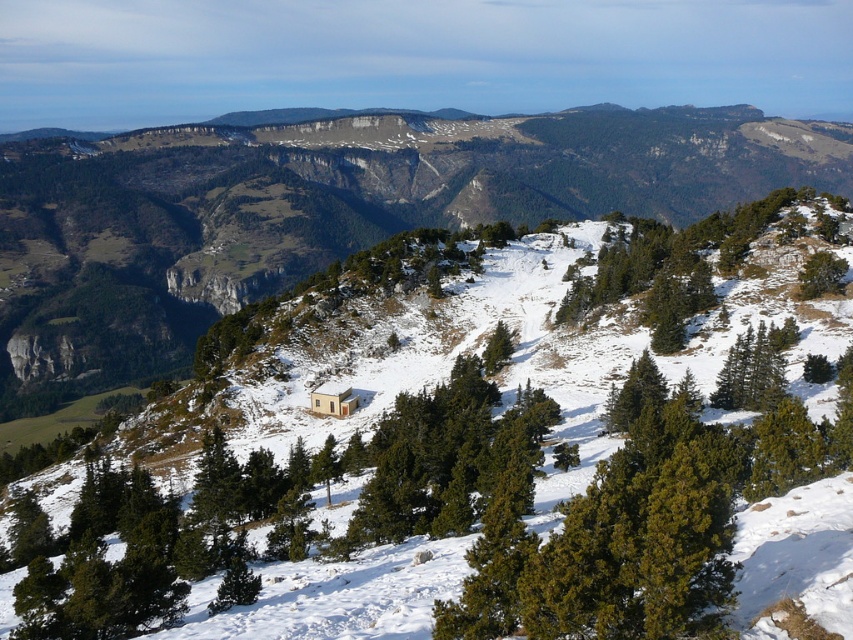
Can you confirm if green matte tree at center is bigger than light brown wooden hut at center?

Yes, green matte tree at center is bigger than light brown wooden hut at center.

Describe the element at coordinates (466, 500) in the screenshot. I see `green matte tree at center` at that location.

Describe the element at coordinates (466, 500) in the screenshot. This screenshot has width=853, height=640. I see `green matte tree at center` at that location.

At what (x,y) coordinates should I click in order to perform the action: click on green matte tree at center. Please return your answer as a coordinate pair (x, y). Looking at the image, I should click on (466, 500).